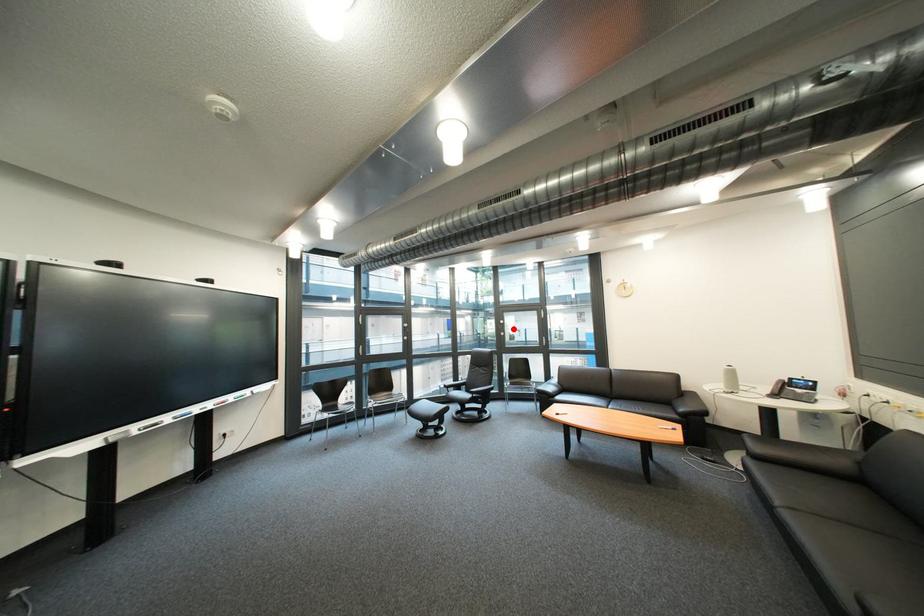
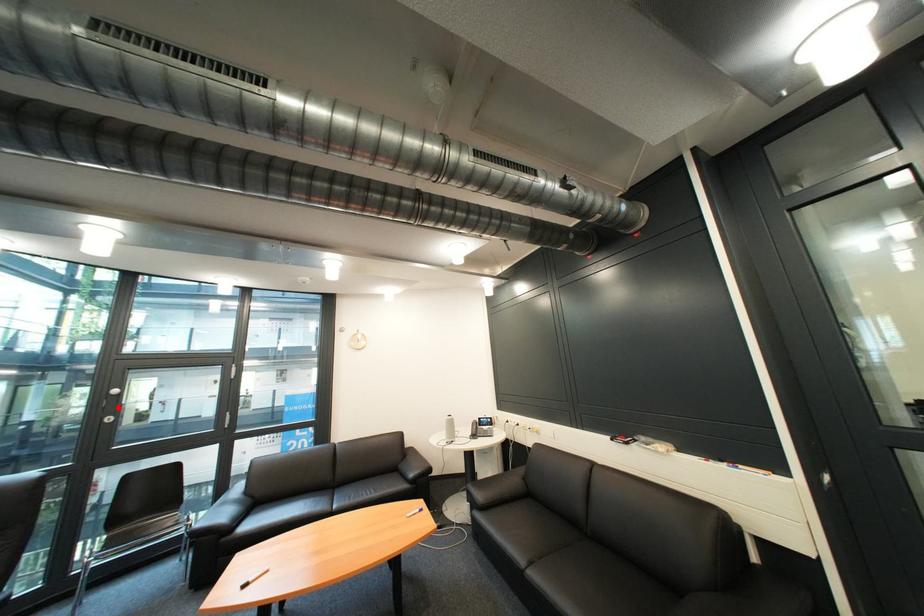
From the picture: I am providing you with two images of the same scene from different viewpoints. A red point is marked on the first image and another point is marked on the second image. Is the red point in image1 aligned with the point shown in image2?

Yes